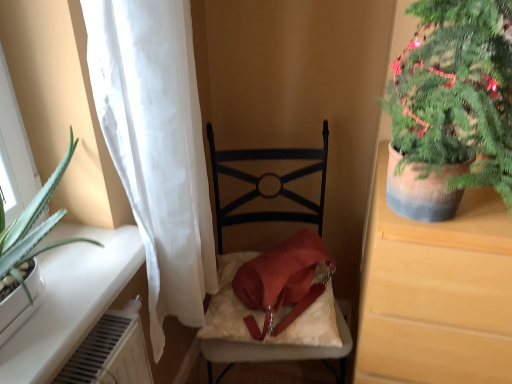
Question: Looking at their shapes, would you say green textured plant at upper right is wider or thinner than matte brown cabinet at right?

Choices:
 (A) thin
 (B) wide

Answer: (A)

Question: From a real-world perspective, relative to matte brown cabinet at right, is green textured plant at upper right vertically above or below?

Choices:
 (A) above
 (B) below

Answer: (A)

Question: Which object is positioned farthest from the velvet-like white pillow at center?

Choices:
 (A) white sheer curtain at left
 (B) matte black chair at center
 (C) matte brown cabinet at right
 (D) green textured plant at upper right

Answer: (D)

Question: Based on their relative distances, which object is nearer to the matte brown cabinet at right?

Choices:
 (A) matte black chair at center
 (B) white sheer curtain at left
 (C) green textured plant at upper right
 (D) velvet-like white pillow at center

Answer: (C)